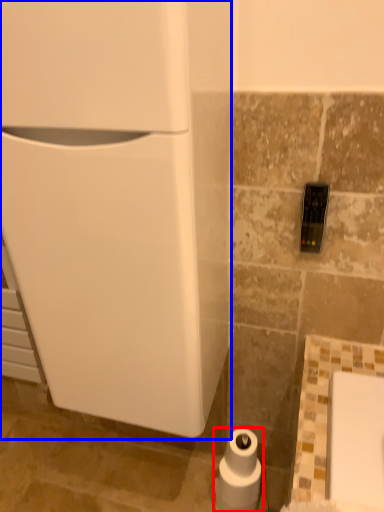
Question: Which of the following is the farthest to the observer, toilet paper (highlighted by a red box) or appliance (highlighted by a blue box)?

Choices:
 (A) toilet paper
 (B) appliance

Answer: (A)